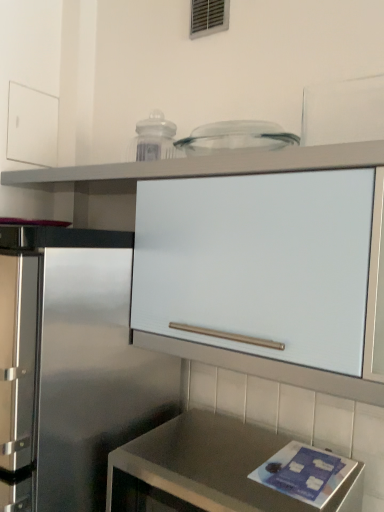
What is the approximate height of white matte drawer at upper left?

8.12 inches.

What do you see at coordinates (32, 126) in the screenshot? Image resolution: width=384 pixels, height=512 pixels. I see `white matte drawer at upper left` at bounding box center [32, 126].

Locate an element on the screen. Image resolution: width=384 pixels, height=512 pixels. satin metallic countertop at lower center is located at coordinates (208, 469).

This screenshot has width=384, height=512. In order to click on white matte drawer at upper left in this screenshot , I will do `click(32, 126)`.

You are a GUI agent. You are given a task and a screenshot of the screen. Output one action in this format:
    pyautogui.click(x=<x>, y=<y>)
    Task: Click on the countertop that appears below the white matte cabinet at upper center (from a real-world perspective)
    
    Given the screenshot: What is the action you would take?
    pyautogui.click(x=208, y=469)

Consider the image. Who is taller, satin metallic countertop at lower center or white matte cabinet at upper center?

With more height is white matte cabinet at upper center.

From the image's perspective, which one is positioned higher, satin metallic countertop at lower center or white matte cabinet at upper center?

white matte cabinet at upper center appears higher in the image.

Between satin metallic countertop at lower center and white matte cabinet at upper center, which one has larger width?

satin metallic countertop at lower center.

From the picture: Considering the relative sizes of white matte cabinet at upper center and white matte drawer at upper left in the image provided, is white matte cabinet at upper center wider than white matte drawer at upper left?

Indeed, white matte cabinet at upper center has a greater width compared to white matte drawer at upper left.

Between white matte cabinet at upper center and white matte drawer at upper left, which one appears on the right side from the viewer's perspective?

white matte cabinet at upper center.

Between white matte cabinet at upper center and white matte drawer at upper left, which one has larger size?

With larger size is white matte cabinet at upper center.

From the image's perspective, is metallic vent at upper center above or below white matte cabinet at upper center?

Based on their image positions, metallic vent at upper center is located above white matte cabinet at upper center.

Who is bigger, metallic vent at upper center or white matte cabinet at upper center?

white matte cabinet at upper center.

Where is `window above the white matte cabinet at upper center (from the image's perspective)`? The width and height of the screenshot is (384, 512). window above the white matte cabinet at upper center (from the image's perspective) is located at coordinates (208, 17).

Who is taller, metallic vent at upper center or white matte cabinet at upper center?

With more height is white matte cabinet at upper center.

Which object is wider, satin metallic countertop at lower center or metallic vent at upper center?

Wider between the two is satin metallic countertop at lower center.

Is metallic vent at upper center completely or partially inside satin metallic countertop at lower center?

No, metallic vent at upper center is located outside of satin metallic countertop at lower center.

Are satin metallic countertop at lower center and metallic vent at upper center far apart?

That's right, there is a large distance between satin metallic countertop at lower center and metallic vent at upper center.

Between point (274, 438) and point (216, 21), which one is positioned behind?

The point (216, 21) is behind.

Is white matte drawer at upper left located within satin metallic countertop at lower center?

No, white matte drawer at upper left is not a part of satin metallic countertop at lower center.

How distant is satin metallic countertop at lower center from white matte drawer at upper left?

satin metallic countertop at lower center and white matte drawer at upper left are 3.78 feet apart from each other.

Is satin metallic countertop at lower center not near white matte drawer at upper left?

Indeed, satin metallic countertop at lower center is not near white matte drawer at upper left.

Is point (207, 160) positioned after point (311, 509)?

That is True.

Looking at this image, how different are the orientations of white matte cabinet at upper center and satin metallic countertop at lower center in degrees?

0.1 degrees separate the facing orientations of white matte cabinet at upper center and satin metallic countertop at lower center.

From the image's perspective, is white matte cabinet at upper center located above or below satin metallic countertop at lower center?

Clearly, from the image's perspective, white matte cabinet at upper center is above satin metallic countertop at lower center.

Is white matte cabinet at upper center turned away from satin metallic countertop at lower center?

No, satin metallic countertop at lower center is not at the back of white matte cabinet at upper center.

Is metallic vent at upper center inside or outside of satin metallic countertop at lower center?

metallic vent at upper center lies outside satin metallic countertop at lower center.

From a real-world perspective, is metallic vent at upper center physically located above or below satin metallic countertop at lower center?

In terms of real-world spatial position, metallic vent at upper center is above satin metallic countertop at lower center.

Consider the image. Which is behind, metallic vent at upper center or satin metallic countertop at lower center?

metallic vent at upper center.

In the image, there is a white matte cabinet at upper center. Identify the location of countertop below it (from a real-world perspective). The image size is (384, 512). (208, 469).

The height and width of the screenshot is (512, 384). I want to click on drawer that appears on the left of white matte cabinet at upper center, so pyautogui.click(x=32, y=126).

Which object lies nearer to the anchor point white matte drawer at upper left, white matte cabinet at upper center or metallic vent at upper center?

white matte cabinet at upper center.

Which object lies nearer to the anchor point metallic vent at upper center, white matte cabinet at upper center or white matte drawer at upper left?

The object closer to metallic vent at upper center is white matte cabinet at upper center.

Estimate the real-world distances between objects in this image. Which object is further from white matte drawer at upper left, metallic vent at upper center or white matte cabinet at upper center?

The object further to white matte drawer at upper left is metallic vent at upper center.

When comparing their distances from satin metallic countertop at lower center, does metallic vent at upper center or white matte drawer at upper left seem further?

Among the two, metallic vent at upper center is located further to satin metallic countertop at lower center.

Estimate the real-world distances between objects in this image. Which object is closer to metallic vent at upper center, satin metallic countertop at lower center or white matte drawer at upper left?

The object closer to metallic vent at upper center is white matte drawer at upper left.

From the image, which object appears to be farther from white matte drawer at upper left, white matte cabinet at upper center or satin metallic countertop at lower center?

Among the two, satin metallic countertop at lower center is located further to white matte drawer at upper left.

In the scene shown: Based on their spatial positions, is satin metallic countertop at lower center or white matte cabinet at upper center closer to white matte drawer at upper left?

The object closer to white matte drawer at upper left is white matte cabinet at upper center.

From the image, which object appears to be nearer to satin metallic countertop at lower center, white matte cabinet at upper center or white matte drawer at upper left?

white matte cabinet at upper center is closer to satin metallic countertop at lower center.

Where is `drawer between metallic vent at upper center and white matte cabinet at upper center from top to bottom`? This screenshot has height=512, width=384. drawer between metallic vent at upper center and white matte cabinet at upper center from top to bottom is located at coordinates (32, 126).

You are a GUI agent. You are given a task and a screenshot of the screen. Output one action in this format:
    pyautogui.click(x=<x>, y=<y>)
    Task: Click on the cabinetry between metallic vent at upper center and satin metallic countertop at lower center in the vertical direction
    This screenshot has height=512, width=384.
    Given the screenshot: What is the action you would take?
    pyautogui.click(x=180, y=176)

Where is `drawer between metallic vent at upper center and satin metallic countertop at lower center in the vertical direction`? drawer between metallic vent at upper center and satin metallic countertop at lower center in the vertical direction is located at coordinates (32, 126).

The width and height of the screenshot is (384, 512). I want to click on cabinetry between white matte drawer at upper left and satin metallic countertop at lower center in the vertical direction, so click(x=180, y=176).